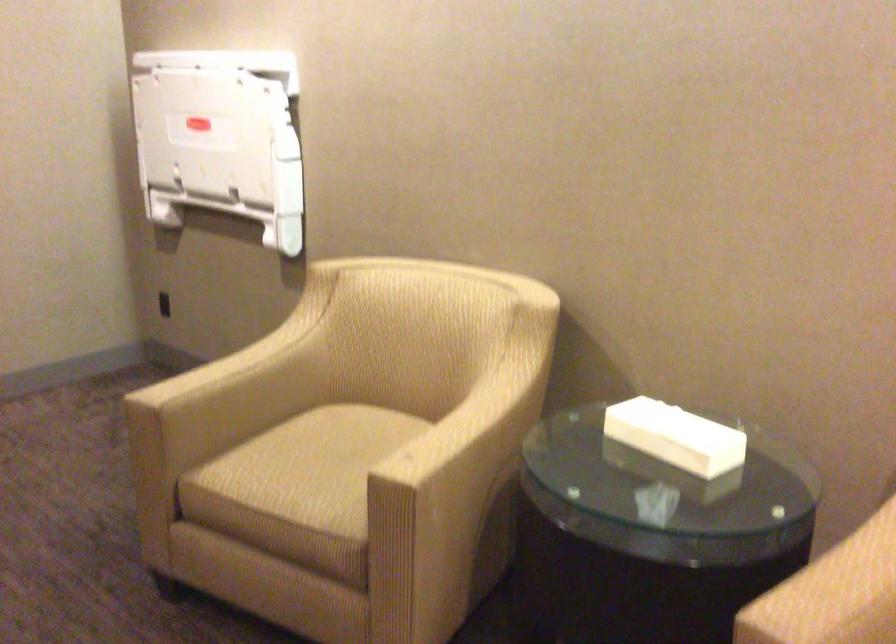
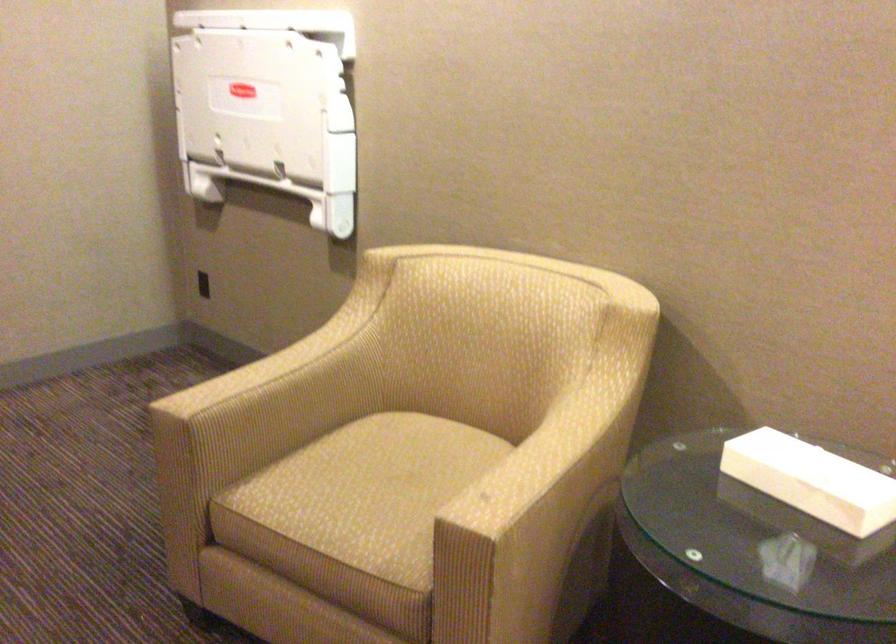
Locate, in the second image, the point that corresponds to the point at 315,467 in the first image.

(371, 491)